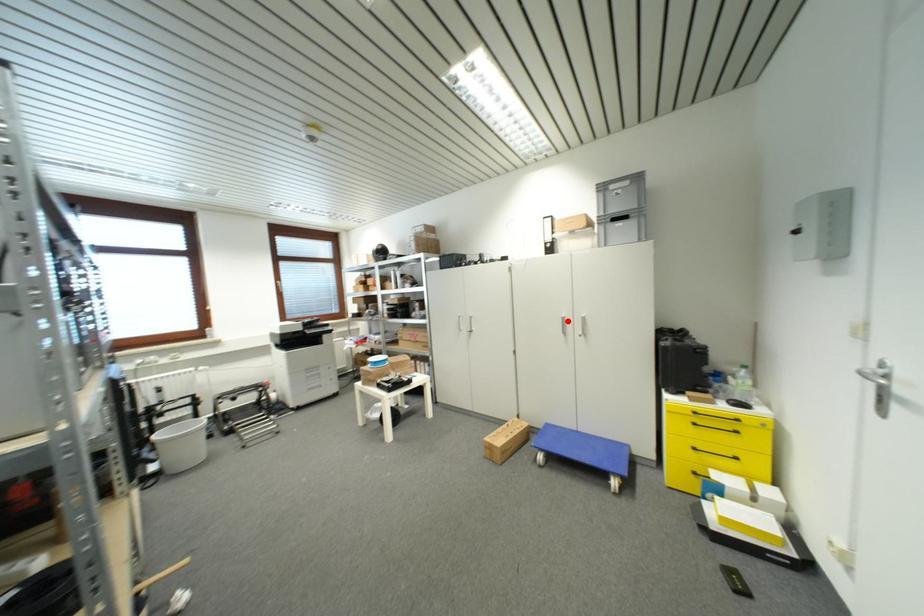
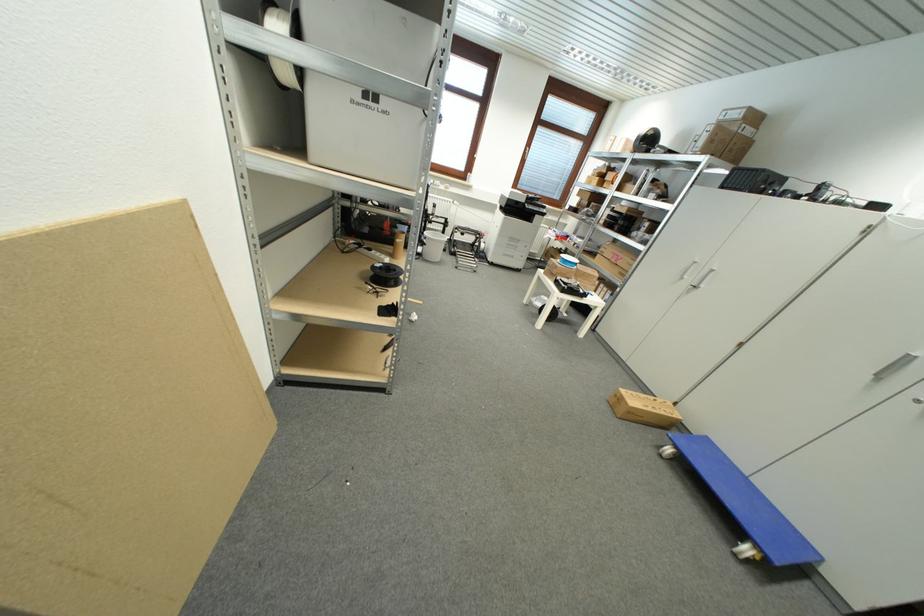
Where in the second image is the point corresponding to the highlighted location from the first image?

(913, 361)